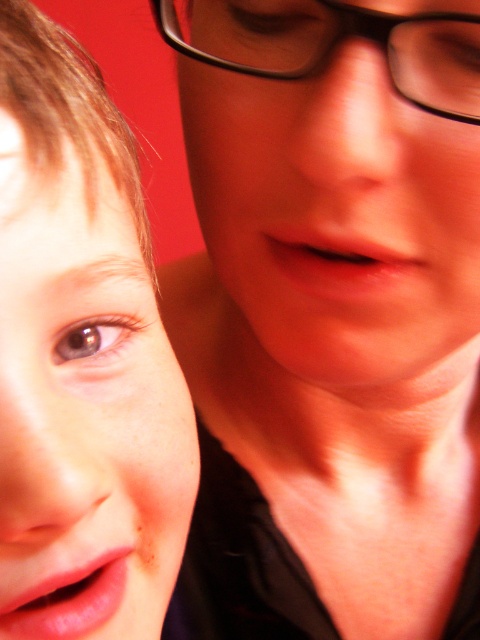
You are taking a photo of two people standing in front of you. The left person has a point at coordinates point (396, 26) and the right person has a point at point (51, 621). If you want to focus on the person closer to you, which point should you focus on?

You should focus on point (51, 621) because it is closer to the camera than point (396, 26).

You are a photographer adjusting the lighting for a portrait. You notice the smooth skin face at left and the black plastic glasses at upper center in your frame. Which object is positioned higher in the image?

The black plastic glasses at upper center are positioned higher in the image than the smooth skin face at left.

You are a photographer adjusting your camera settings. You notice two objects in the frame that need to be focused on properly. The smooth skin face at left and the black plastic glasses at upper center. Which object should you focus on first to ensure it appears sharp in the photo?

The smooth skin face at left should be focused on first because it is closer to the viewer than the black plastic glasses at upper center, so focusing on the closer object ensures sharpness.